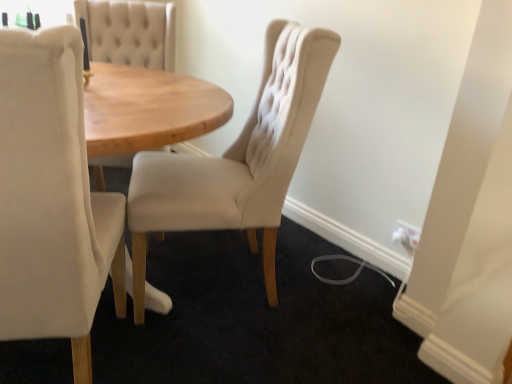
Find the location of a particular element. This screenshot has width=512, height=384. vacant area that lies to the right of beige fabric chair at left, which is the 1th chair in left-to-right order is located at coordinates (205, 350).